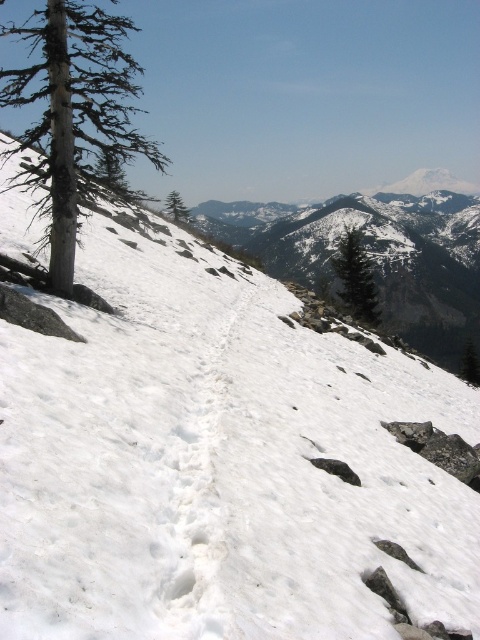
You are a hiker planning to take a photo from your current position. You want to include both the point at coordinates (x=134, y=90) and the point at coordinates (x=352, y=307) in your frame. Which point will appear closer to the bottom of the photo?

The point at coordinates (x=134, y=90) will appear closer to the bottom of the photo because it is closer to the viewer than the point at coordinates (x=352, y=307).

You are a hiker trying to navigate the snowy mountain slope. You see a point marked at coordinates (73, 115). What object does this point correspond to?

The point at coordinates (73, 115) corresponds to the smooth gray bark tree at left.